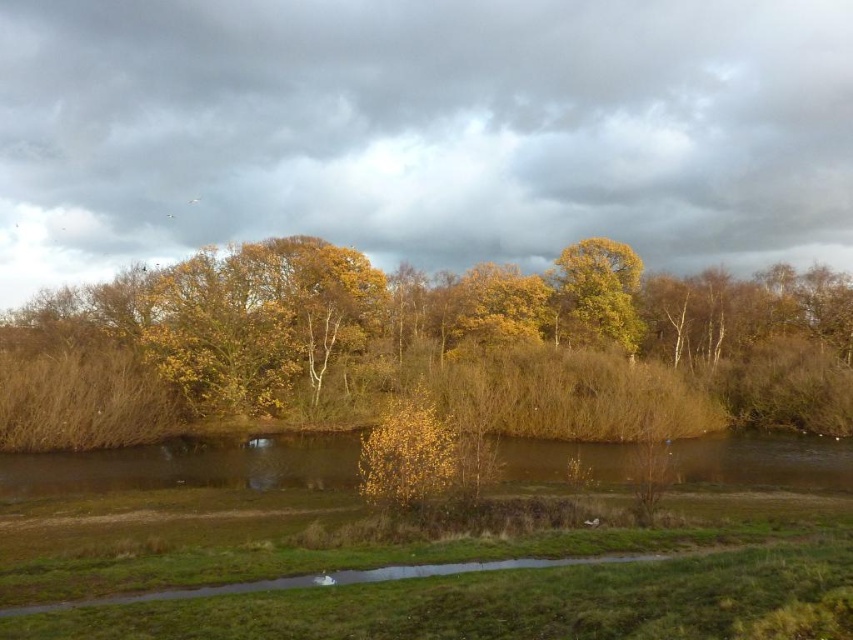
Which is more to the right, yellow leafy tree at center or yellow leafy tree at upper center?

From the viewer's perspective, yellow leafy tree at upper center appears more on the right side.

Can you confirm if yellow leafy tree at center is positioned to the left of yellow leafy tree at upper center?

Indeed, yellow leafy tree at center is positioned on the left side of yellow leafy tree at upper center.

Is point (595, 420) positioned before point (601, 328)?

Yes, it is.

Locate an element on the screen. The height and width of the screenshot is (640, 853). yellow leafy tree at center is located at coordinates (422, 348).